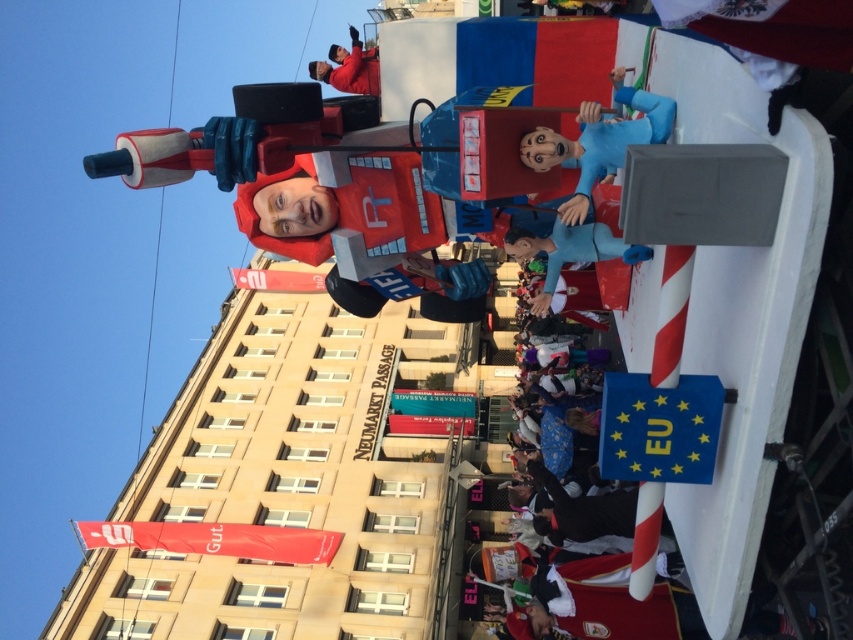
Does blue matte mannequin at center appear under blue matte figure at center?

No, blue matte mannequin at center is not below blue matte figure at center.

Which is below, blue matte mannequin at center or blue matte figure at center?

blue matte figure at center is lower down.

Is point (581, 193) positioned after point (637, 260)?

No.

Find the location of a particular element. Image resolution: width=853 pixels, height=640 pixels. blue matte mannequin at center is located at coordinates (596, 141).

Does red jacket at upper center have a larger size compared to orange fabric flag at center?

No.

Does red jacket at upper center appear on the right side of orange fabric flag at center?

Correct, you'll find red jacket at upper center to the right of orange fabric flag at center.

Does point (325, 76) lie in front of point (294, 288)?

Yes, it is.

Where is `red jacket at upper center`? red jacket at upper center is located at coordinates (349, 67).

Which is behind, point (102, 540) or point (349, 26)?

The point (349, 26) is more distant.

Can you confirm if red fabric banner at lower left is shorter than red jacket at upper center?

In fact, red fabric banner at lower left may be taller than red jacket at upper center.

Who is more forward, [253,545] or [344,88]?

Point [344,88] is more forward.

Locate an element on the screen. The height and width of the screenshot is (640, 853). red fabric banner at lower left is located at coordinates (215, 540).